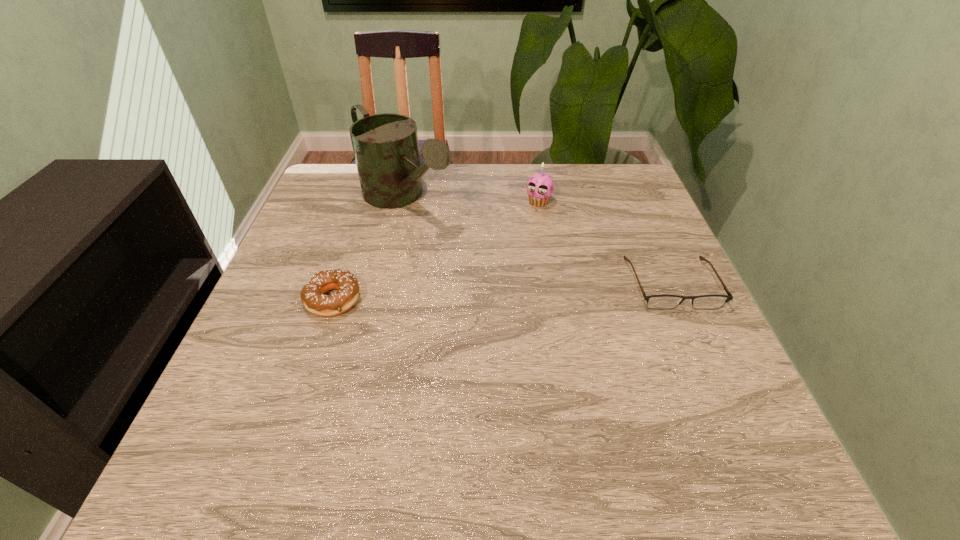
Where is `free location at the far edge of the desktop`? free location at the far edge of the desktop is located at coordinates (540, 165).

Identify the location of vacant position at the near edge of the desktop. (574, 423).

Locate an element on the screen. This screenshot has height=540, width=960. vacant space at the left edge of the desktop is located at coordinates pyautogui.click(x=315, y=370).

Where is `free space at the right edge of the desktop`? free space at the right edge of the desktop is located at coordinates (648, 319).

Locate an element on the screen. vacant area at the far right corner is located at coordinates (628, 195).

Locate an element on the screen. This screenshot has height=540, width=960. free space at the near right corner of the desktop is located at coordinates 746,417.

You are a GUI agent. You are given a task and a screenshot of the screen. Output one action in this format:
    pyautogui.click(x=<x>, y=<y>)
    Task: Click on the free spot between the watering can and the second object from right to left
    
    Given the screenshot: What is the action you would take?
    pyautogui.click(x=471, y=200)

Where is `vacant space in between the cupcake and the doughnut`? Image resolution: width=960 pixels, height=540 pixels. vacant space in between the cupcake and the doughnut is located at coordinates (436, 251).

You are a GUI agent. You are given a task and a screenshot of the screen. Output one action in this format:
    pyautogui.click(x=<x>, y=<y>)
    Task: Click on the vacant area that lies between the shortest object and the second tallest object
    
    Given the screenshot: What is the action you would take?
    pyautogui.click(x=605, y=242)

In order to click on free space between the third shortest object and the watering can in this screenshot , I will do `click(471, 200)`.